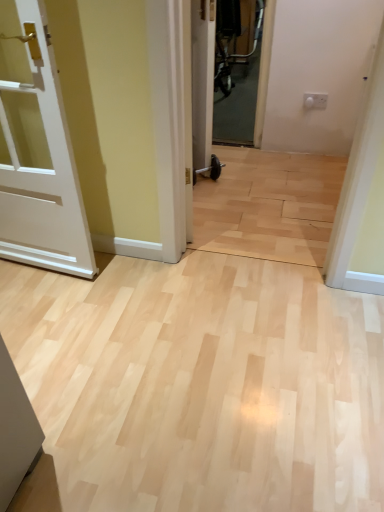
Question: From their relative heights in the image, would you say white glossy door at center, positioned as the first door in top-to-bottom order, is taller or shorter than white matte door at left, arranged as the 2th door when viewed from the right?

Choices:
 (A) short
 (B) tall

Answer: (A)

Question: Looking at their shapes, would you say white glossy door at center, the 2th door in the left-to-right sequence, is wider or thinner than white matte door at left, arranged as the 2th door when viewed from the right?

Choices:
 (A) thin
 (B) wide

Answer: (A)

Question: Which is correct: white glossy door at center, which ranks as the 2th door in bottom-to-top order, is inside white matte door at left, which is the 1th door from bottom to top, or outside of it?

Choices:
 (A) inside
 (B) outside

Answer: (B)

Question: Is white matte door at left, which is the 1th door from bottom to top, to the left or to the right of white glossy door at center, positioned as the first door in top-to-bottom order, in the image?

Choices:
 (A) right
 (B) left

Answer: (B)

Question: From a real-world perspective, relative to white glossy door at center, which is the second door in front-to-back order, is white matte door at left, arranged as the 1th door when viewed from the front, vertically above or below?

Choices:
 (A) below
 (B) above

Answer: (B)

Question: From the image's perspective, is white matte door at left, which ranks as the 2th door in top-to-bottom order, located above or below white glossy door at center, which is the 1th door in right-to-left order?

Choices:
 (A) below
 (B) above

Answer: (A)

Question: Based on their sizes in the image, would you say white matte door at left, which ranks as the 2th door in top-to-bottom order, is bigger or smaller than white glossy door at center, which is the first door in back-to-front order?

Choices:
 (A) big
 (B) small

Answer: (A)